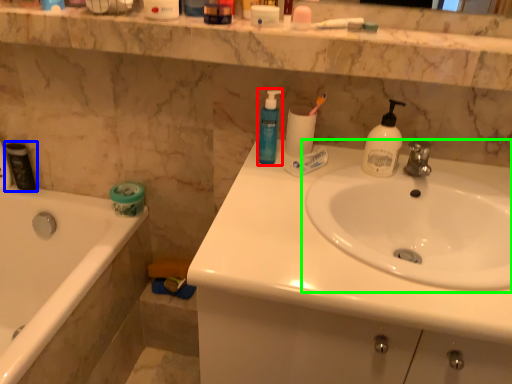
Question: Which is farther away from soap dispenser (highlighted by a red box)? mouthwash (highlighted by a blue box) or sink (highlighted by a green box)?

Choices:
 (A) mouthwash
 (B) sink

Answer: (A)